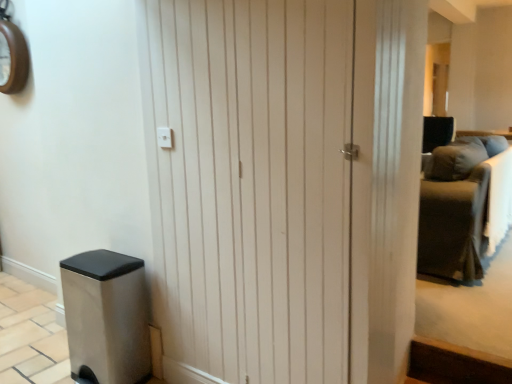
Question: From a real-world perspective, is dark gray fabric couch at right under wooden clock at upper left?

Choices:
 (A) yes
 (B) no

Answer: (A)

Question: Is dark gray fabric couch at right facing towards wooden clock at upper left?

Choices:
 (A) yes
 (B) no

Answer: (B)

Question: Is dark gray fabric couch at right outside wooden clock at upper left?

Choices:
 (A) no
 (B) yes

Answer: (B)

Question: From the image's perspective, does dark gray fabric couch at right appear lower than wooden clock at upper left?

Choices:
 (A) yes
 (B) no

Answer: (A)

Question: Can you confirm if dark gray fabric couch at right is taller than wooden clock at upper left?

Choices:
 (A) no
 (B) yes

Answer: (B)

Question: Is dark gray fabric couch at right far away from wooden clock at upper left?

Choices:
 (A) no
 (B) yes

Answer: (B)

Question: Would you say white wood door at center is a long distance from dark gray fabric couch at right?

Choices:
 (A) yes
 (B) no

Answer: (A)

Question: Considering the relative sizes of white wood door at center and dark gray fabric couch at right in the image provided, is white wood door at center shorter than dark gray fabric couch at right?

Choices:
 (A) yes
 (B) no

Answer: (B)

Question: Is white wood door at center positioned before dark gray fabric couch at right?

Choices:
 (A) no
 (B) yes

Answer: (B)

Question: From the image's perspective, is white wood door at center located beneath dark gray fabric couch at right?

Choices:
 (A) yes
 (B) no

Answer: (A)

Question: Is white wood door at center bigger than dark gray fabric couch at right?

Choices:
 (A) no
 (B) yes

Answer: (A)

Question: Is white wood door at center turned away from dark gray fabric couch at right?

Choices:
 (A) no
 (B) yes

Answer: (B)

Question: Can you confirm if dark gray fabric couch at right is shorter than white wood door at center?

Choices:
 (A) yes
 (B) no

Answer: (A)